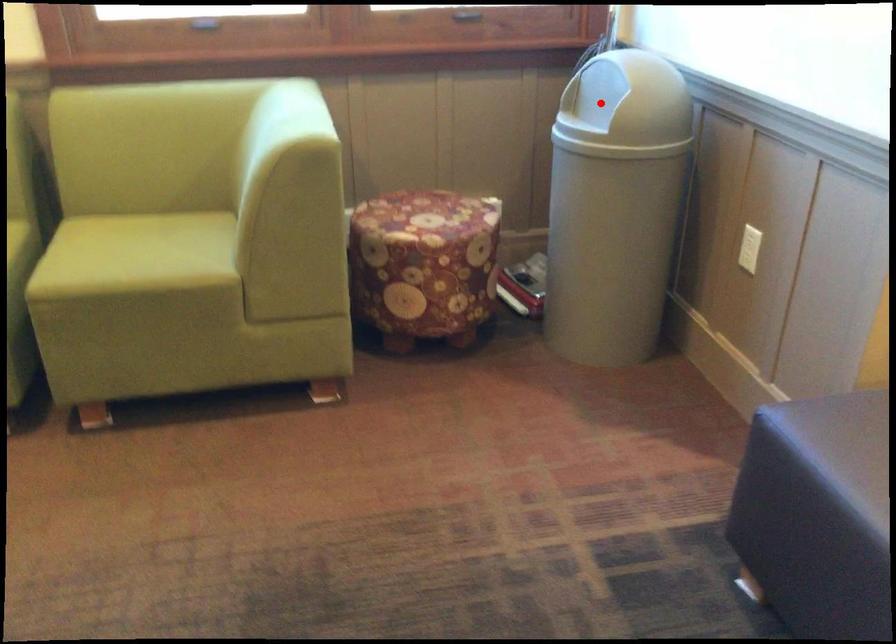
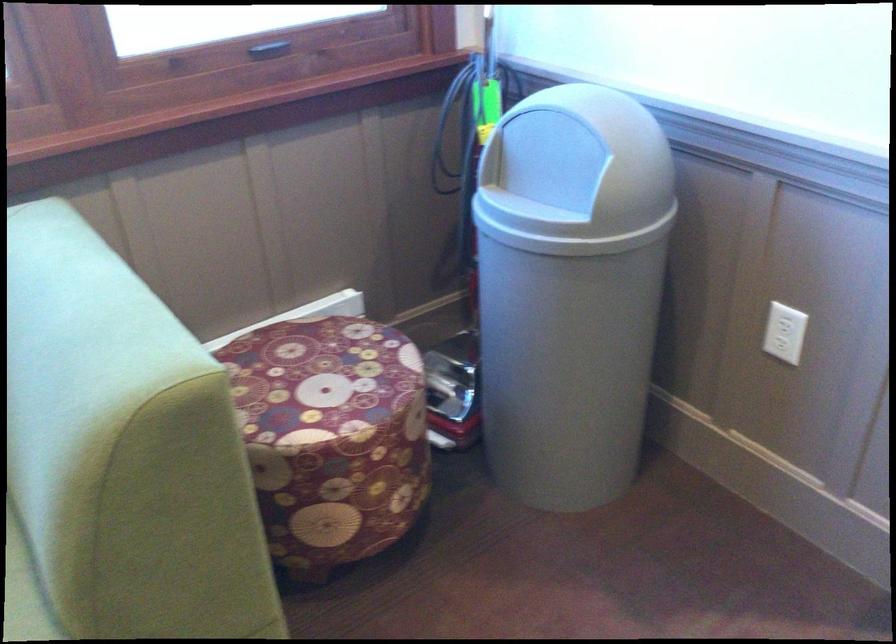
In the second image, find the point that corresponds to the highlighted location in the first image.

(550, 174)